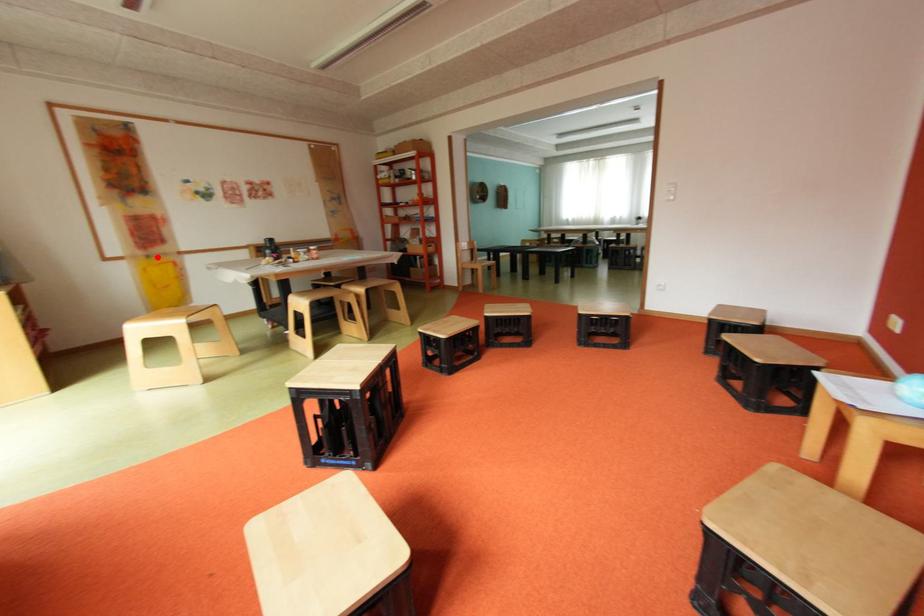
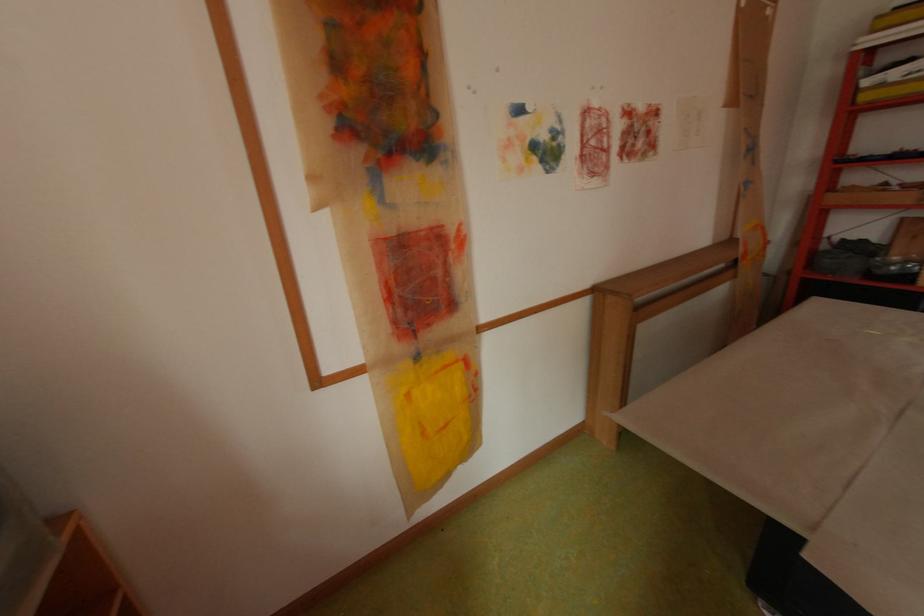
Find the pixel in the second image that matches the highlighted location in the first image.

(429, 358)